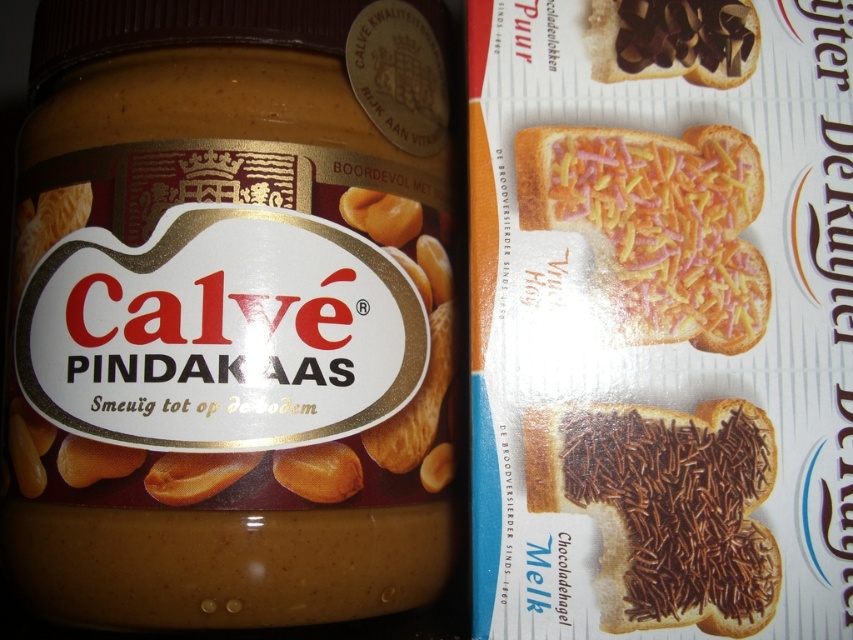
Does yellow sprinkled bread at center lie in front of chocolate spread at upper right?

Yes.

Locate an element on the screen. The width and height of the screenshot is (853, 640). yellow sprinkled bread at center is located at coordinates (656, 227).

Can you confirm if brown crunchy chocolate spread at center is bigger than yellow sprinkled bread at center?

Incorrect, brown crunchy chocolate spread at center is not larger than yellow sprinkled bread at center.

Who is lower down, brown crunchy chocolate spread at center or yellow sprinkled bread at center?

brown crunchy chocolate spread at center is below.

Who is more distant from viewer, (x=610, y=624) or (x=537, y=225)?

Point (x=537, y=225)

Locate an element on the screen. The height and width of the screenshot is (640, 853). brown crunchy chocolate spread at center is located at coordinates (664, 508).

Who is lower down, brown crunchy chocolate spread at center or chocolate spread at upper right?

brown crunchy chocolate spread at center is lower down.

Based on the photo, does brown crunchy chocolate spread at center appear over chocolate spread at upper right?

Actually, brown crunchy chocolate spread at center is below chocolate spread at upper right.

Who is more distant from viewer, (x=698, y=545) or (x=733, y=65)?

The point (x=733, y=65) is behind.

Identify the location of brown crunchy chocolate spread at center. (664, 508).